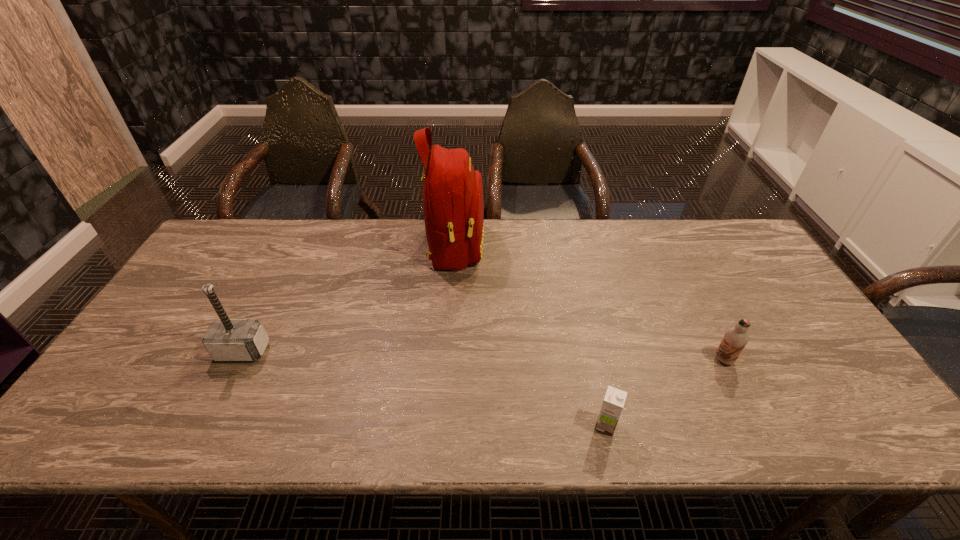
Identify the location of vacant space located on the front of the right chocolate milk. Image resolution: width=960 pixels, height=540 pixels. 738,389.

In order to click on free space located on the back of the left chocolate milk in this screenshot , I will do `click(594, 377)`.

Identify the location of object located in the far edge section of the desktop. Image resolution: width=960 pixels, height=540 pixels. (453, 205).

The width and height of the screenshot is (960, 540). In order to click on object at the near edge in this screenshot , I will do `click(614, 400)`.

In order to click on vacant space at the far edge in this screenshot , I will do `click(664, 245)`.

In order to click on vacant space at the near edge in this screenshot , I will do `click(329, 422)`.

I want to click on free space at the left edge, so click(171, 352).

In the image, there is a desktop. At what (x,y) coordinates should I click in order to perform the action: click on vacant space at the right edge. Please return your answer as a coordinate pair (x, y). The height and width of the screenshot is (540, 960). Looking at the image, I should click on (736, 276).

I want to click on blank area at the far left corner, so click(222, 240).

Identify the location of vacant space at the far right corner of the desktop. (748, 260).